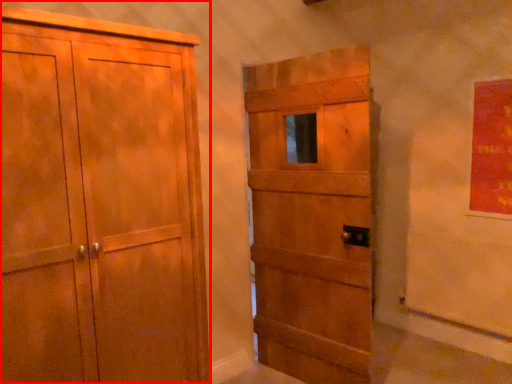
Question: Where is cupboard (annotated by the red box) located in relation to door in the image?

Choices:
 (A) right
 (B) left

Answer: (B)